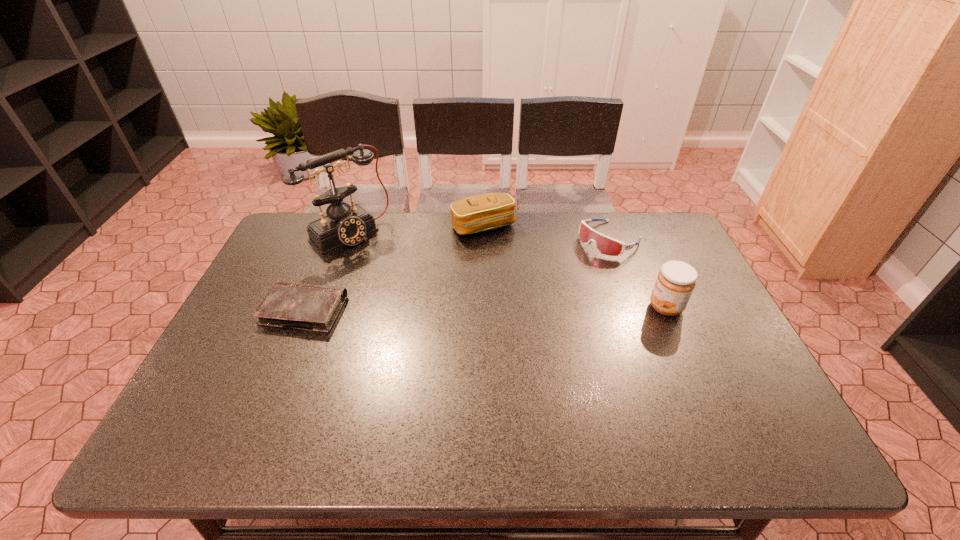
Locate an element on the screen. vacant region at the left edge of the desktop is located at coordinates (238, 358).

The image size is (960, 540). In the image, there is a desktop. Identify the location of vacant space at the far left corner. (293, 223).

Find the location of a particular element. The height and width of the screenshot is (540, 960). vacant space at the near left corner of the desktop is located at coordinates (227, 400).

This screenshot has width=960, height=540. In the image, there is a desktop. In order to click on vacant space at the far right corner in this screenshot , I will do `click(654, 255)`.

Locate an element on the screen. This screenshot has width=960, height=540. vacant space at the near right corner of the desktop is located at coordinates (751, 399).

Locate an element on the screen. This screenshot has width=960, height=540. vacant space in between the telephone and the jam is located at coordinates (507, 271).

Where is `free spot between the tallest object and the second tallest object`? The width and height of the screenshot is (960, 540). free spot between the tallest object and the second tallest object is located at coordinates (507, 271).

Locate an element on the screen. vacant area that lies between the telephone and the jam is located at coordinates pyautogui.click(x=507, y=271).

Identify the location of vacant area between the fourth tallest object and the jam. The image size is (960, 540). (638, 273).

Where is `free area in between the fourth tallest object and the diary`? The height and width of the screenshot is (540, 960). free area in between the fourth tallest object and the diary is located at coordinates (457, 275).